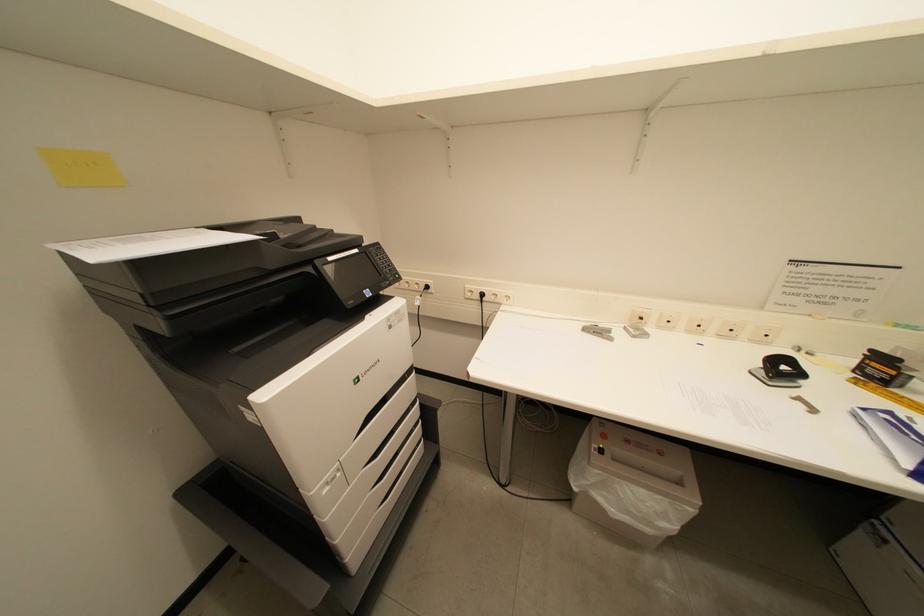
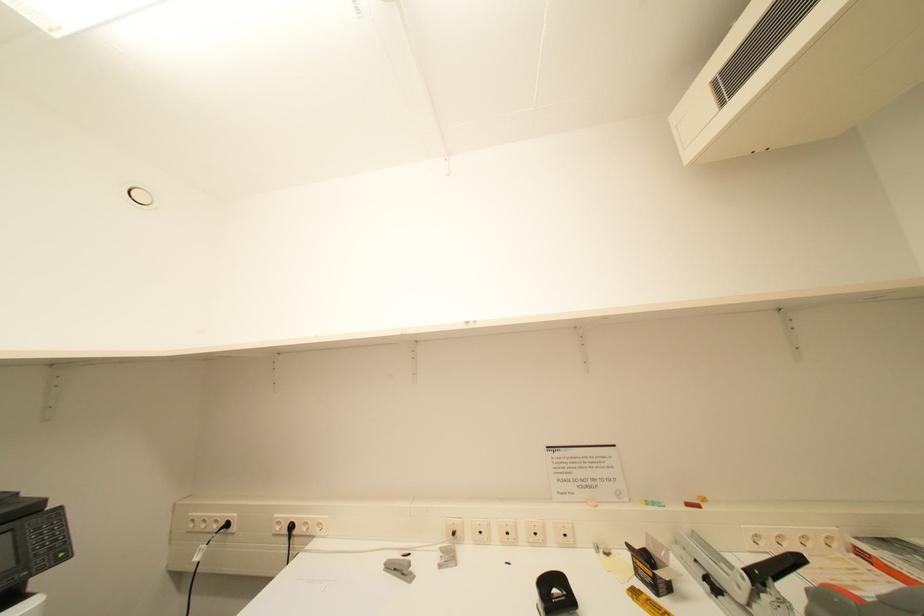
The first image is from the beginning of the video and the second image is from the end. How did the camera likely rotate when shooting the video?

The camera's rotation is toward right-up.